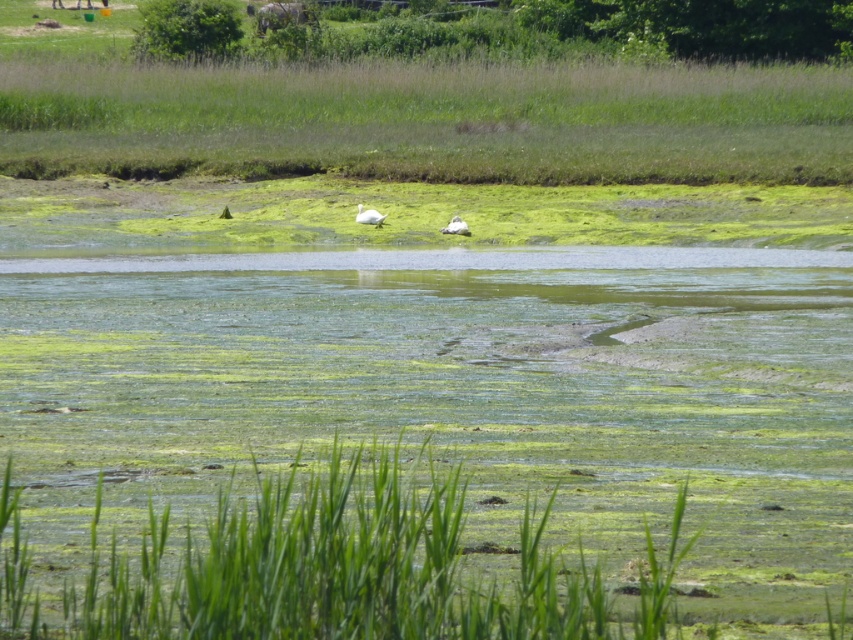
Does green leafy grass at lower center have a greater height compared to white matte duck at center?

Yes.

Who is higher up, green leafy grass at lower center or white matte duck at center?

white matte duck at center

Between point (315, 576) and point (451, 234), which one is positioned behind?

The point (451, 234) is more distant.

The image size is (853, 640). Identify the location of green leafy grass at lower center. (331, 566).

What do you see at coordinates (369, 216) in the screenshot? I see `white feathered swan at center` at bounding box center [369, 216].

Who is more distant from viewer, (381, 221) or (442, 232)?

Point (381, 221)

Is point (358, 211) closer to viewer compared to point (444, 230)?

No, (358, 211) is behind (444, 230).

I want to click on white feathered swan at center, so click(369, 216).

Does green leafy grass at lower center have a smaller size compared to white feathered bird at upper center?

No.

Can you confirm if green leafy grass at lower center is shorter than white feathered bird at upper center?

Indeed, green leafy grass at lower center has a lesser height compared to white feathered bird at upper center.

Describe the element at coordinates (331, 566) in the screenshot. I see `green leafy grass at lower center` at that location.

This screenshot has height=640, width=853. Identify the location of green leafy grass at lower center. (331, 566).